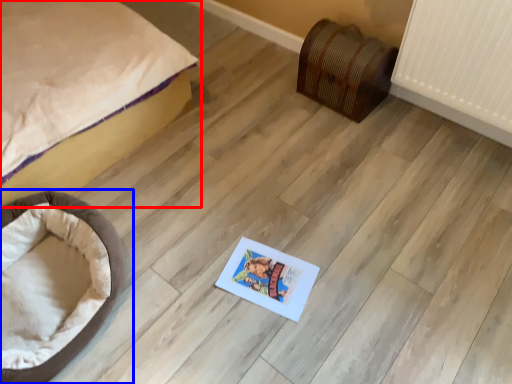
Question: Which object is closer to the camera taking this photo, bed (highlighted by a red box) or dog bed (highlighted by a blue box)?

Choices:
 (A) bed
 (B) dog bed

Answer: (A)